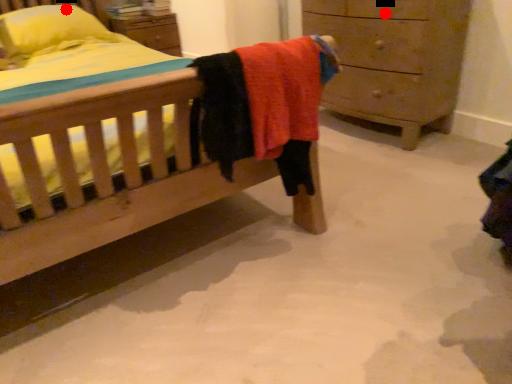
Question: Two points are circled on the image, labeled by A and B beside each circle. Which point is closer to the camera taking this photo?

Choices:
 (A) A is closer
 (B) B is closer

Answer: (A)